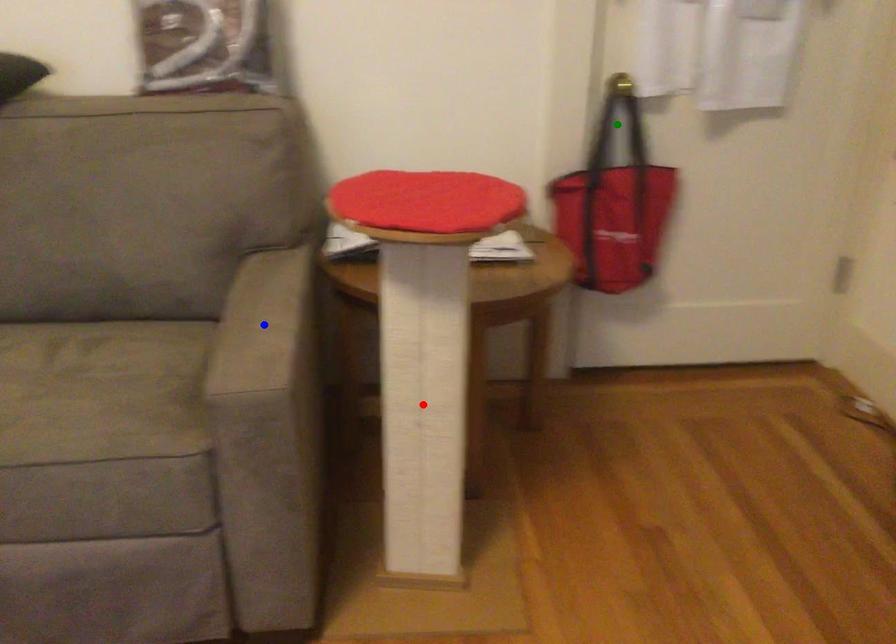
Order these from nearest to farthest:
blue point
green point
red point

blue point, red point, green point